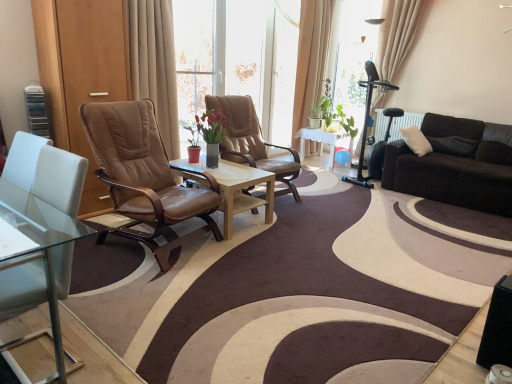
Question: Would you say beige fabric curtain at upper right, arranged as the 2th curtain when viewed from the front, is outside leather at center, the second chair in the front-to-back sequence?

Choices:
 (A) no
 (B) yes

Answer: (B)

Question: Could you tell me if beige fabric curtain at upper right, which appears as the 3th curtain when viewed from the left, is turned towards leather at center, which ranks as the first chair in back-to-front order?

Choices:
 (A) yes
 (B) no

Answer: (A)

Question: From a real-world perspective, is beige fabric curtain at upper right, which is counted as the first curtain, starting from the right, located higher than leather at center, which ranks as the first chair in back-to-front order?

Choices:
 (A) no
 (B) yes

Answer: (B)

Question: Is beige fabric curtain at upper right, arranged as the 2th curtain when viewed from the front, thinner than leather at center, which ranks as the first chair in back-to-front order?

Choices:
 (A) yes
 (B) no

Answer: (A)

Question: Is beige fabric curtain at upper right, which is the 2th curtain in back-to-front order, surrounding leather at center, the second chair in the front-to-back sequence?

Choices:
 (A) no
 (B) yes

Answer: (A)

Question: Is beige fabric curtain at upper right, arranged as the 2th curtain when viewed from the front, closer to the viewer compared to leather at center, the second chair in the front-to-back sequence?

Choices:
 (A) no
 (B) yes

Answer: (A)

Question: From a real-world perspective, is beige fabric curtain at upper right, which is the 2th curtain in back-to-front order, positioned under white glossy table at center based on gravity?

Choices:
 (A) no
 (B) yes

Answer: (A)

Question: Is beige fabric curtain at upper right, arranged as the 2th curtain when viewed from the front, oriented towards white glossy table at center?

Choices:
 (A) yes
 (B) no

Answer: (B)

Question: Does beige fabric curtain at upper right, which appears as the 3th curtain when viewed from the left, have a lesser height compared to white glossy table at center?

Choices:
 (A) yes
 (B) no

Answer: (B)

Question: From a real-world perspective, does beige fabric curtain at upper right, arranged as the 2th curtain when viewed from the front, stand above white glossy table at center?

Choices:
 (A) no
 (B) yes

Answer: (B)

Question: Considering the relative sizes of beige fabric curtain at upper right, which is the 2th curtain in back-to-front order, and white glossy table at center in the image provided, is beige fabric curtain at upper right, which is the 2th curtain in back-to-front order, taller than white glossy table at center?

Choices:
 (A) no
 (B) yes

Answer: (B)

Question: From the image's perspective, is beige fabric curtain at upper right, which is counted as the first curtain, starting from the right, above white glossy table at center?

Choices:
 (A) no
 (B) yes

Answer: (B)

Question: Is beige fabric curtain at upper right, which appears as the 3th curtain when viewed from the left, taller than brown leather chair at center, the 2th chair when ordered from back to front?

Choices:
 (A) yes
 (B) no

Answer: (A)